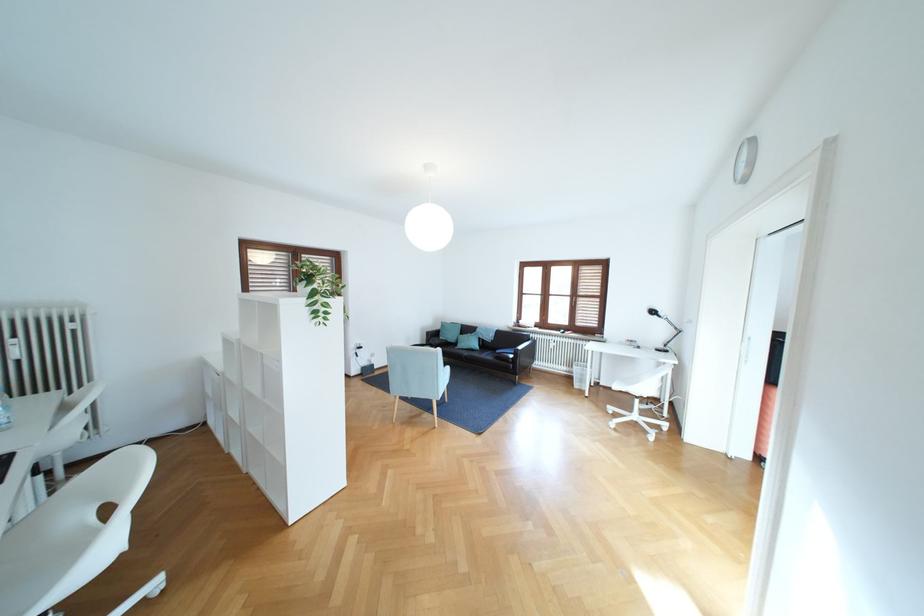
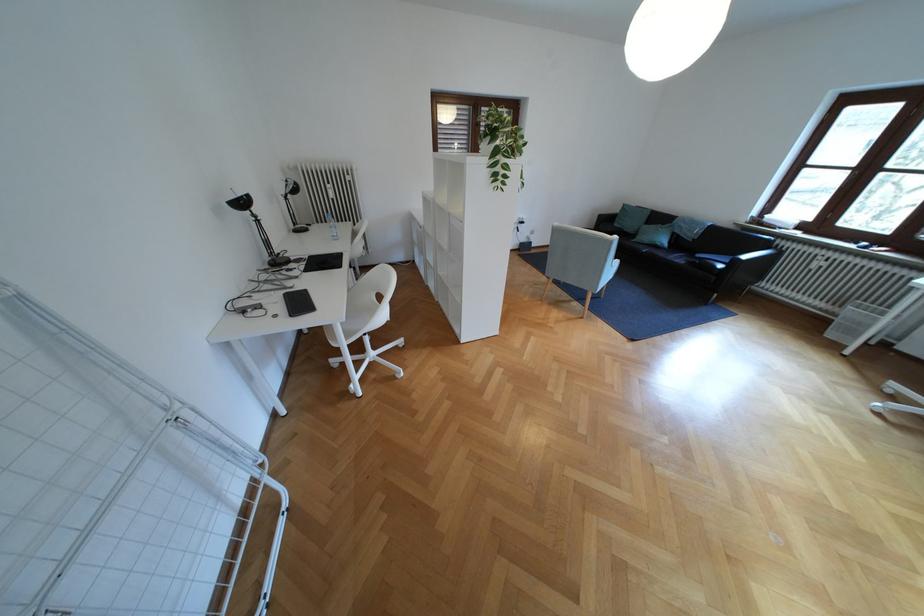
Where in the second image is the point corresponding to [451,339] from the first image?

(626, 225)